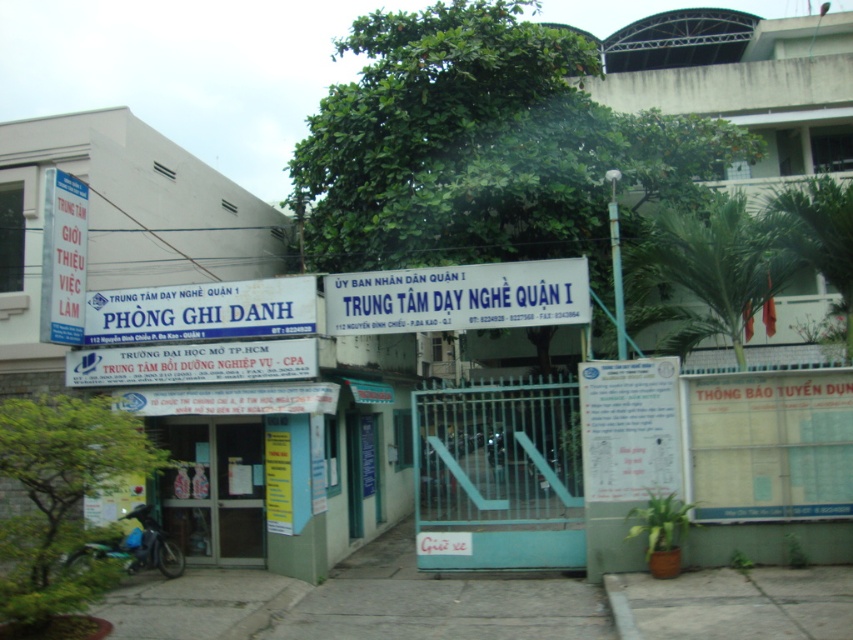
Question: Can you confirm if gray concrete pavement at center is positioned to the left of white plastic sign at center?

Choices:
 (A) no
 (B) yes

Answer: (B)

Question: Which object is farther from the camera taking this photo?

Choices:
 (A) gray concrete pavement at center
 (B) gray concrete pavement at lower center

Answer: (A)

Question: Estimate the real-world distances between objects in this image. Which object is farther from the white matte sign at center?

Choices:
 (A) white paperboard at center
 (B) gray concrete pavement at center
 (C) gray concrete pavement at lower center

Answer: (C)

Question: Can you confirm if gray concrete pavement at center is positioned to the right of gray concrete pavement at lower center?

Choices:
 (A) yes
 (B) no

Answer: (B)

Question: Which object is positioned closest to the white matte sign at center?

Choices:
 (A) white paperboard at center
 (B) gray concrete pavement at center

Answer: (B)

Question: Is white plastic sign at center bigger than white matte sign at center?

Choices:
 (A) yes
 (B) no

Answer: (A)